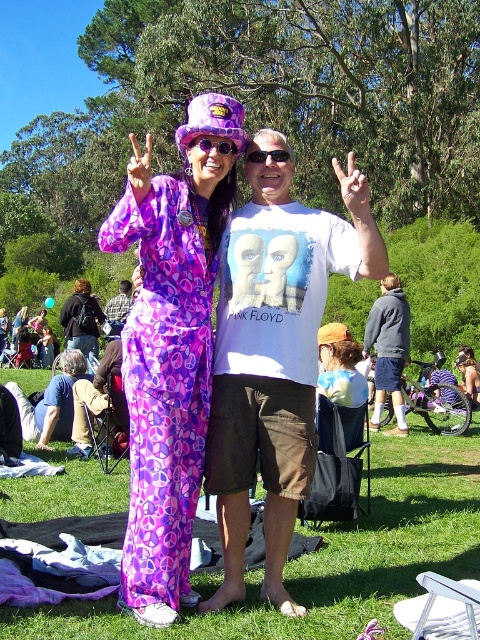
Which of these two, light brown leather jacket at lower left or black plastic sunglasses at center, stands taller?

With more height is light brown leather jacket at lower left.

Describe the element at coordinates (50, 403) in the screenshot. I see `light brown leather jacket at lower left` at that location.

Where is `light brown leather jacket at lower left`? The height and width of the screenshot is (640, 480). light brown leather jacket at lower left is located at coordinates (50, 403).

Based on the photo, between dark gray hoodie at center and purple fabric hand at center, which one is positioned higher?

purple fabric hand at center is higher up.

Image resolution: width=480 pixels, height=640 pixels. What do you see at coordinates (388, 349) in the screenshot?
I see `dark gray hoodie at center` at bounding box center [388, 349].

Is point (386, 280) less distant than point (139, 161)?

That is False.

You are a GUI agent. You are given a task and a screenshot of the screen. Output one action in this format:
    pyautogui.click(x=<x>, y=<y>)
    Task: Click on the dark gray hoodie at center
    
    Given the screenshot: What is the action you would take?
    pyautogui.click(x=388, y=349)

Is the position of purple fabric blanket at lower center less distant than that of purple fabric goggles at center?

Yes.

Who is taller, purple fabric blanket at lower center or purple fabric goggles at center?

Standing taller between the two is purple fabric blanket at lower center.

Is point (111, 524) positioned in front of point (208, 136)?

No, it is behind (208, 136).

Identify the location of purple fabric blanket at lower center. (70, 531).